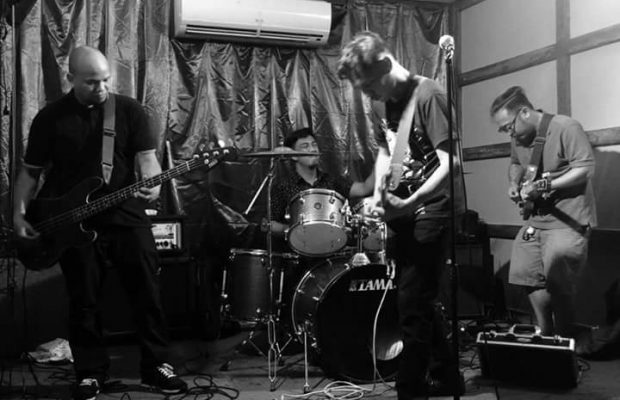
This screenshot has height=400, width=620. Identify the location of cords. click(x=345, y=390), click(x=218, y=385).